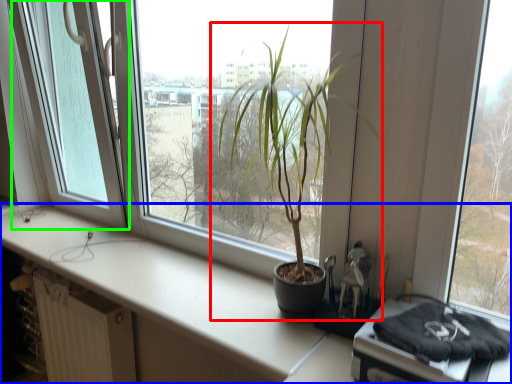
Question: Which object is positioned closest to houseplant (highlighted by a red box)? Select from counter top (highlighted by a blue box) and glass door (highlighted by a green box).

Choices:
 (A) counter top
 (B) glass door

Answer: (A)